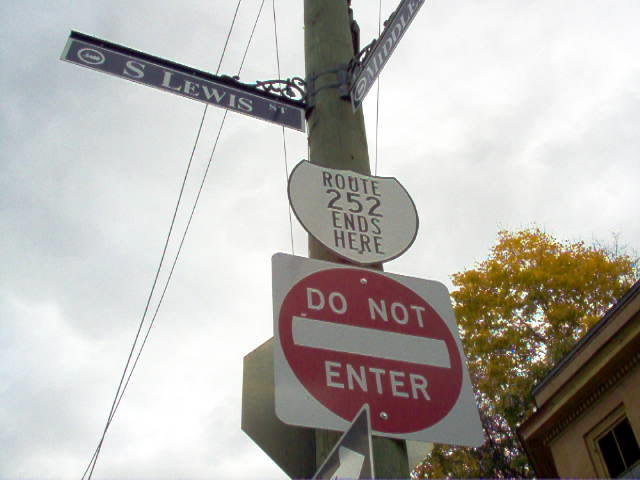
Locate an element on the screen. white bar is located at coordinates click(x=383, y=357).